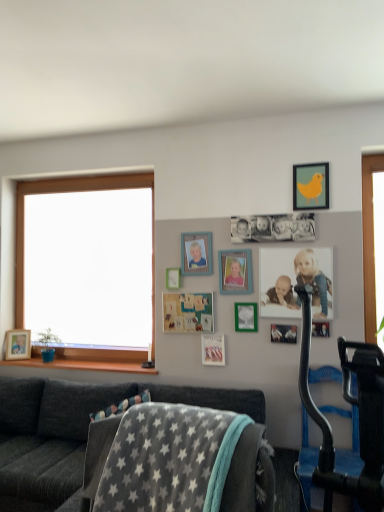
You are a GUI agent. You are given a task and a screenshot of the screen. Output one action in this format:
    pyautogui.click(x=<x>, y=<y>)
    Task: Click on the velvet dark gray couch at lower left
    The height and width of the screenshot is (512, 384).
    Given the screenshot: What is the action you would take?
    pyautogui.click(x=75, y=433)

In order to face matte white picture frame at center, which is the 2th picture frame from back to front, should I rotate leftwards or rightwards?

A 2.517 degree turn to the left will do.

Where is `matte white picture frame at center, the 2th picture frame viewed from the left`? This screenshot has width=384, height=512. matte white picture frame at center, the 2th picture frame viewed from the left is located at coordinates (173, 278).

At what (x,y) coordinates should I click in order to perform the action: click on green matte picture frame at upper center, the seventh picture frame when ordered from left to right. Please return your answer as a coordinate pair (x, y). Image resolution: width=384 pixels, height=512 pixels. Looking at the image, I should click on (246, 317).

Identify the location of wooden picture frame at upper center, which is the 10th picture frame from back to front. This screenshot has height=512, width=384. 320,329.

The height and width of the screenshot is (512, 384). I want to click on black plastic exercise machine at right, so [359, 416].

What do you see at coordinates (196, 254) in the screenshot? The width and height of the screenshot is (384, 512). I see `matte plastic photo frame at upper center, placed as the 4th picture frame when sorted from left to right` at bounding box center [196, 254].

How much space does metallic silver photo frame at center, which ranks as the 8th picture frame in left-to-right order, occupy vertically?

It is 5.45 inches.

The width and height of the screenshot is (384, 512). I want to click on metallic silver photo frame at center, the eighth picture frame in the back-to-front sequence, so coord(284,333).

What do you see at coordinates (81, 364) in the screenshot? The width and height of the screenshot is (384, 512). I see `wooden at left` at bounding box center [81, 364].

Locate an element on the screen. This screenshot has width=384, height=512. velvet dark gray couch at lower left is located at coordinates (75, 433).

How many degrees apart are the facing directions of metallic silver photo frame at center, the eighth picture frame in the back-to-front sequence, and matte white photo frame at center, the eleventh picture frame positioned from the back?

The angular difference between metallic silver photo frame at center, the eighth picture frame in the back-to-front sequence, and matte white photo frame at center, the eleventh picture frame positioned from the back, is 0.861 degrees.

From a real-world perspective, does metallic silver photo frame at center, the fourth picture frame in the right-to-left sequence, sit lower than matte white photo frame at center, which is counted as the ninth picture frame, starting from the left?

Indeed, from a real-world perspective, metallic silver photo frame at center, the fourth picture frame in the right-to-left sequence, is positioned beneath matte white photo frame at center, which is counted as the ninth picture frame, starting from the left.

From the image's perspective, which one is positioned lower, metallic silver photo frame at center, the fourth picture frame in the right-to-left sequence, or matte white photo frame at center, which is counted as the ninth picture frame, starting from the left?

metallic silver photo frame at center, the fourth picture frame in the right-to-left sequence, appears lower in the image.

Can we say metallic silver photo frame at center, the fourth picture frame in the right-to-left sequence, lies outside matte white photo frame at center, the eleventh picture frame positioned from the back?

That's correct, metallic silver photo frame at center, the fourth picture frame in the right-to-left sequence, is outside of matte white photo frame at center, the eleventh picture frame positioned from the back.

Which of these two, matte white photo frame at center, which ranks as the first picture frame in front-to-back order, or teal matte corkboard at center, positioned as the 8th picture frame in front-to-back order, is smaller?

Smaller between the two is teal matte corkboard at center, positioned as the 8th picture frame in front-to-back order.

Looking at their sizes, would you say matte white photo frame at center, which ranks as the first picture frame in front-to-back order, is wider or thinner than teal matte corkboard at center, the third picture frame positioned from the left?

matte white photo frame at center, which ranks as the first picture frame in front-to-back order, is thinner than teal matte corkboard at center, the third picture frame positioned from the left.

There is a matte white photo frame at center, which is counted as the ninth picture frame, starting from the left. Where is `the 1st picture frame below it (from a real-world perspective)`? the 1st picture frame below it (from a real-world perspective) is located at coordinates (187, 312).

Can you tell me how much matte white photo frame at center, the eleventh picture frame positioned from the back, and teal matte corkboard at center, the third picture frame positioned from the left, differ in facing direction?

0.126 degrees separate the facing orientations of matte white photo frame at center, the eleventh picture frame positioned from the back, and teal matte corkboard at center, the third picture frame positioned from the left.

Would you say wooden at left is a long distance from black plastic exercise machine at right?

Yes, wooden at left is far from black plastic exercise machine at right.

From the image's perspective, is wooden at left on top of black plastic exercise machine at right?

Incorrect, from the image's perspective, wooden at left is lower than black plastic exercise machine at right.

Considering the sizes of wooden at left and black plastic exercise machine at right in the image, is wooden at left wider or thinner than black plastic exercise machine at right?

In the image, wooden at left appears to be more narrow than black plastic exercise machine at right.

Is matte white picture frame at center, the 2th picture frame viewed from the left, oriented away from velvet dark gray couch at lower left?

No, velvet dark gray couch at lower left is not at the back of matte white picture frame at center, the 2th picture frame viewed from the left.

Looking at this image, is matte white picture frame at center, the tenth picture frame when ordered from front to back, far from velvet dark gray couch at lower left?

matte white picture frame at center, the tenth picture frame when ordered from front to back, is positioned a significant distance from velvet dark gray couch at lower left.

In the scene shown: From a real-world perspective, is matte white picture frame at center, which is the 2th picture frame from back to front, located higher than velvet dark gray couch at lower left?

Correct, in the physical world, matte white picture frame at center, which is the 2th picture frame from back to front, is higher than velvet dark gray couch at lower left.

Who is shorter, matte white picture frame at center, marked as the tenth picture frame in a right-to-left arrangement, or velvet dark gray couch at lower left?

Standing shorter between the two is matte white picture frame at center, marked as the tenth picture frame in a right-to-left arrangement.

Relative to metallic silver photo frame at center, which is the 4th picture frame from front to back, is matte white photo frame at center, positioned as the 3th picture frame in right-to-left order, in front or behind?

Clearly, matte white photo frame at center, positioned as the 3th picture frame in right-to-left order, is in front of metallic silver photo frame at center, which is the 4th picture frame from front to back.

Measure the distance from matte white photo frame at center, positioned as the 3th picture frame in right-to-left order, to metallic silver photo frame at center, the fourth picture frame in the right-to-left sequence.

The distance of matte white photo frame at center, positioned as the 3th picture frame in right-to-left order, from metallic silver photo frame at center, the fourth picture frame in the right-to-left sequence, is 12.73 inches.

Which is behind, point (287, 293) or point (288, 328)?

The point (287, 293) is behind.

From a real-world perspective, which object stands above the other?

matte white photo frame at center, which ranks as the first picture frame in front-to-back order.

Is matte plastic picture frame at center, marked as the fifth picture frame in a left-to-right arrangement, taller than matte wooden picture frame at lower left, arranged as the first picture frame when viewed from the left?

No, matte plastic picture frame at center, marked as the fifth picture frame in a left-to-right arrangement, is not taller than matte wooden picture frame at lower left, arranged as the first picture frame when viewed from the left.

Does point (219, 352) come closer to viewer compared to point (26, 344)?

Yes, it is.

Which is more to the right, matte plastic picture frame at center, which is the 5th picture frame from back to front, or matte wooden picture frame at lower left, arranged as the first picture frame when viewed from the left?

Positioned to the right is matte plastic picture frame at center, which is the 5th picture frame from back to front.

From the picture: From a real-world perspective, relative to matte wooden picture frame at lower left, acting as the 11th picture frame starting from the right, is matte plastic picture frame at center, the seventh picture frame when ordered from front to back, vertically above or below?

In terms of real-world spatial position, matte plastic picture frame at center, the seventh picture frame when ordered from front to back, is above matte wooden picture frame at lower left, acting as the 11th picture frame starting from the right.

Consider the image. Does matte yellow bird at upper right, which is the ninth picture frame in back-to-front order, have a smaller size compared to wooden at left?

Yes, matte yellow bird at upper right, which is the ninth picture frame in back-to-front order, is smaller than wooden at left.

Which is in front, point (304, 182) or point (40, 366)?

Point (304, 182)

Can you confirm if matte yellow bird at upper right, the 10th picture frame positioned from the left, is positioned to the left of wooden at left?

Incorrect, matte yellow bird at upper right, the 10th picture frame positioned from the left, is not on the left side of wooden at left.

What are the coordinates of `the 4th picture frame below when counting from the matte white photo frame at center, which is counted as the ninth picture frame, starting from the left (from the image's perspective)` in the screenshot? It's located at (284, 333).

I want to click on the 1st picture frame positioned below the matte white photo frame at center, the eleventh picture frame positioned from the back (from a real-world perspective), so click(x=187, y=312).

Based on their spatial positions, is matte yellow bird at upper right, which is the ninth picture frame in back-to-front order, or black plastic exercise machine at right further from metallic silver photo frame at center, which ranks as the 8th picture frame in left-to-right order?

Based on the image, black plastic exercise machine at right appears to be further to metallic silver photo frame at center, which ranks as the 8th picture frame in left-to-right order.

When comparing their distances from wooden picture frame at upper center, the 11th picture frame from the left, does teal matte corkboard at center, positioned as the 8th picture frame in front-to-back order, or matte white picture frame at center, which is the 2th picture frame from back to front, seem closer?

Among the two, teal matte corkboard at center, positioned as the 8th picture frame in front-to-back order, is located nearer to wooden picture frame at upper center, the 11th picture frame from the left.

Based on their spatial positions, is matte plastic picture frame at center, marked as the fifth picture frame in a left-to-right arrangement, or green matte picture frame at upper center, the seventh picture frame positioned from the back, closer to teal matte corkboard at center, which is the 9th picture frame in right-to-left order?

matte plastic picture frame at center, marked as the fifth picture frame in a left-to-right arrangement, is positioned closer to the anchor teal matte corkboard at center, which is the 9th picture frame in right-to-left order.

When comparing their distances from wooden photo frame at center, the 6th picture frame in the right-to-left sequence, does velvet dark gray couch at lower left or black plastic exercise machine at right seem further?

black plastic exercise machine at right lies further to wooden photo frame at center, the 6th picture frame in the right-to-left sequence, than the other object.

From the image, which object appears to be farther from matte wooden picture frame at lower left, arranged as the eleventh picture frame when viewed from the front, teal matte corkboard at center, positioned as the 8th picture frame in front-to-back order, or wooden at left?

teal matte corkboard at center, positioned as the 8th picture frame in front-to-back order, lies further to matte wooden picture frame at lower left, arranged as the eleventh picture frame when viewed from the front, than the other object.

When comparing their distances from wooden picture frame at upper center, the 11th picture frame from the left, does wooden at left or matte yellow bird at upper right, which ranks as the 3th picture frame in front-to-back order, seem further?

Based on the image, wooden at left appears to be further to wooden picture frame at upper center, the 11th picture frame from the left.

Estimate the real-world distances between objects in this image. Which object is further from matte yellow bird at upper right, placed as the 2th picture frame when sorted from right to left, matte plastic photo frame at upper center, placed as the 4th picture frame when sorted from left to right, or matte white picture frame at center, the 2th picture frame viewed from the left?

matte white picture frame at center, the 2th picture frame viewed from the left, lies further to matte yellow bird at upper right, placed as the 2th picture frame when sorted from right to left, than the other object.

Looking at the image, which one is located closer to wooden photo frame at center, which is the sixth picture frame from front to back, teal matte corkboard at center, the third picture frame positioned from the left, or wooden picture frame at upper center, marked as the first picture frame in a right-to-left arrangement?

teal matte corkboard at center, the third picture frame positioned from the left, lies closer to wooden photo frame at center, which is the sixth picture frame from front to back, than the other object.

The width and height of the screenshot is (384, 512). Find the location of `picture frame situated between wooden at left and teal matte corkboard at center, which is the fourth picture frame in back-to-front order, from left to right`. picture frame situated between wooden at left and teal matte corkboard at center, which is the fourth picture frame in back-to-front order, from left to right is located at coordinates (173, 278).

The image size is (384, 512). What are the coordinates of `studio couch between black plastic exercise machine at right and metallic silver photo frame at center, which ranks as the 8th picture frame in left-to-right order, along the z-axis` in the screenshot? It's located at (75, 433).

Image resolution: width=384 pixels, height=512 pixels. In order to click on studio couch between black plastic exercise machine at right and wooden photo frame at center, marked as the 6th picture frame in a left-to-right arrangement, from front to back in this screenshot , I will do `click(75, 433)`.

Locate an element on the screen. The width and height of the screenshot is (384, 512). picture frame located between black plastic exercise machine at right and wooden picture frame at upper center, marked as the 2th picture frame in a front-to-back arrangement, in the depth direction is located at coordinates click(x=295, y=281).